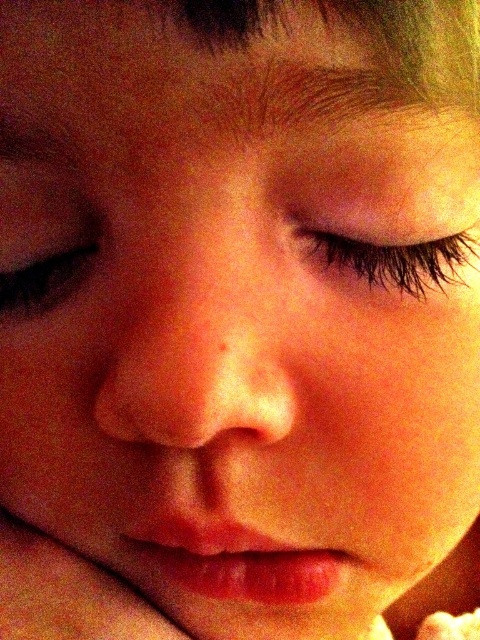
Which is in front, point (442, 257) or point (93, 253)?

Point (442, 257) is in front.

Can you confirm if black eyelashes at center is positioned above brown matte eye at left?

Indeed, black eyelashes at center is positioned over brown matte eye at left.

I want to click on black eyelashes at center, so pyautogui.click(x=396, y=259).